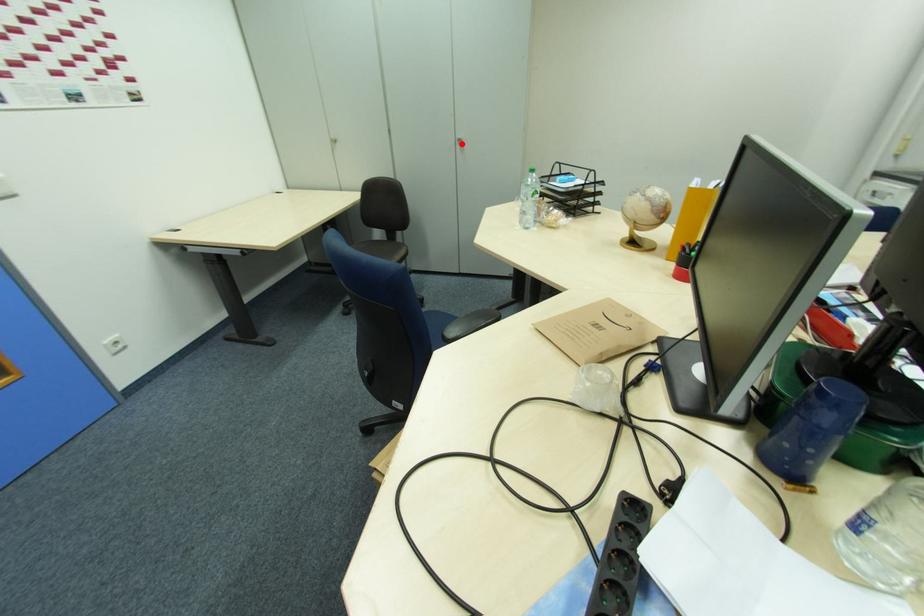
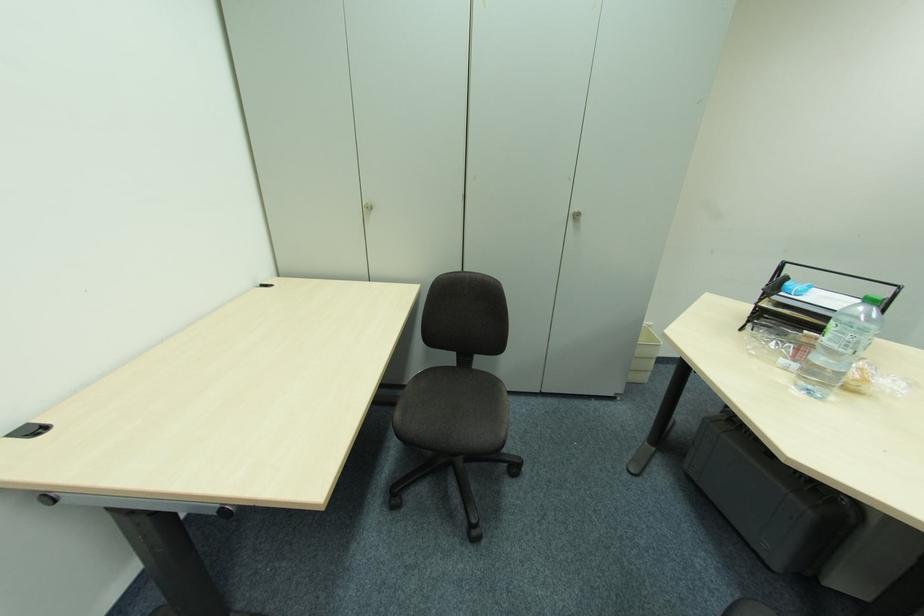
In the second image, find the point that corresponds to the highlighted location in the first image.

(574, 219)